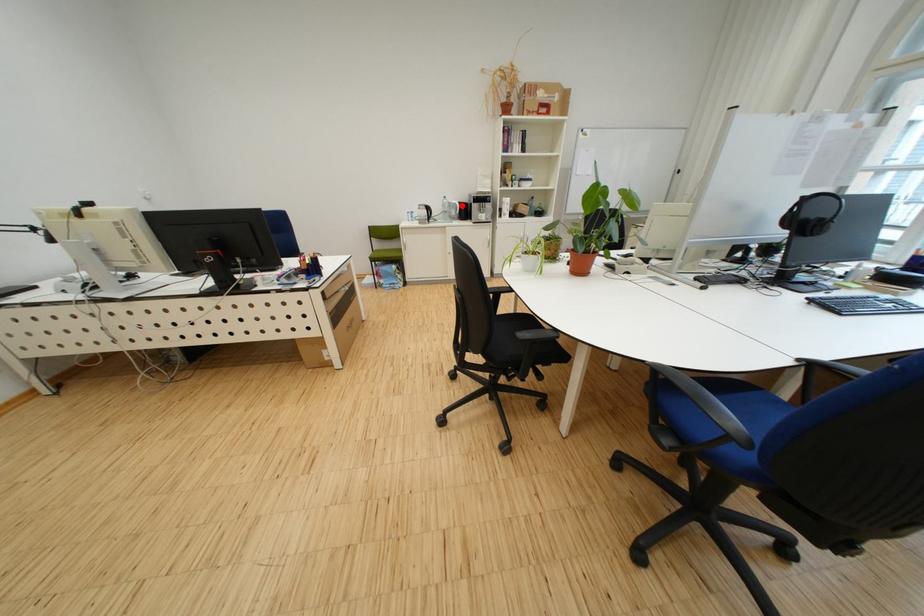
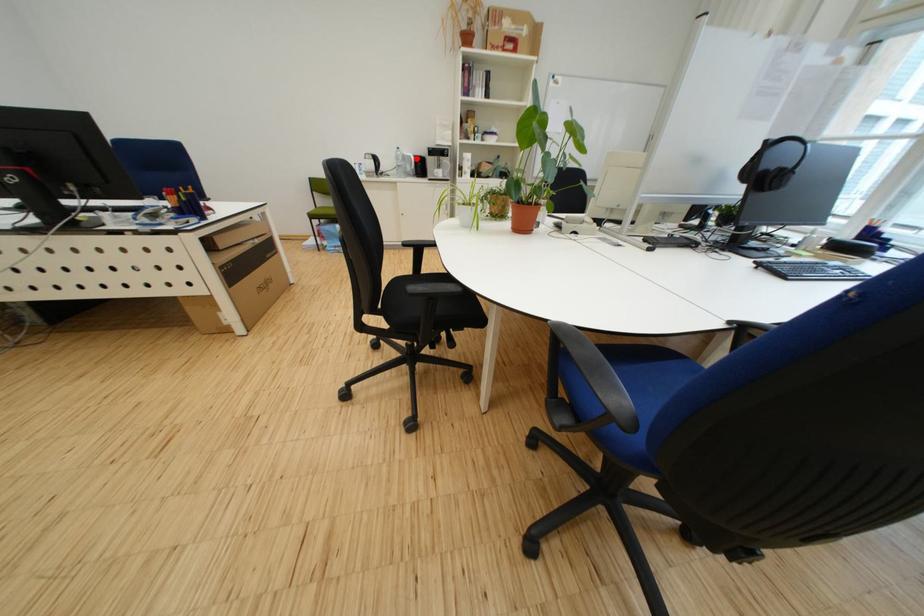
I am providing you with two images of the same scene from different viewpoints. A red point is marked on the first image and another point is marked on the second image. Are the points marked in image1 and image2 representing the same 3D position?

Yes